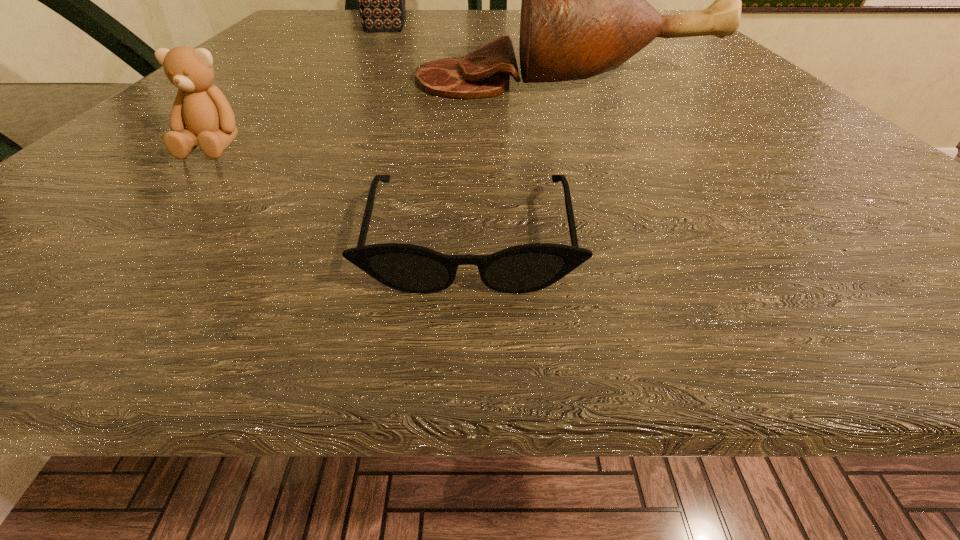
Locate an element on the screen. This screenshot has width=960, height=540. vacant space at the near edge of the desktop is located at coordinates (620, 222).

Where is `vacant space at the left edge of the desktop`? The width and height of the screenshot is (960, 540). vacant space at the left edge of the desktop is located at coordinates (323, 39).

I want to click on free space at the right edge of the desktop, so click(683, 55).

Locate an element on the screen. The image size is (960, 540). vacant space at the far left corner of the desktop is located at coordinates (326, 23).

You are a GUI agent. You are given a task and a screenshot of the screen. Output one action in this format:
    pyautogui.click(x=<x>, y=<y>)
    Task: Click on the free space at the near left corner
    This screenshot has width=960, height=540.
    Given the screenshot: What is the action you would take?
    pyautogui.click(x=96, y=259)

Where is `vacant space that's between the second nearest object and the clutch bag`? Image resolution: width=960 pixels, height=540 pixels. vacant space that's between the second nearest object and the clutch bag is located at coordinates coord(298,87).

The image size is (960, 540). Identify the location of vacant area between the second object from left to right and the second nearest object. (298, 87).

Where is `empty space between the ham and the nearest object`? Image resolution: width=960 pixels, height=540 pixels. empty space between the ham and the nearest object is located at coordinates (518, 157).

Locate an element on the screen. This screenshot has width=960, height=540. object that is the nearest to the sunglasses is located at coordinates (203, 109).

Point out which object is positioned as the nearest to the farthest object. Please provide its 2D coordinates. Your answer should be formatted as a tuple, i.e. [(x, y)], where the tuple contains the x and y coordinates of a point satisfying the conditions above.

[(584, 11)]